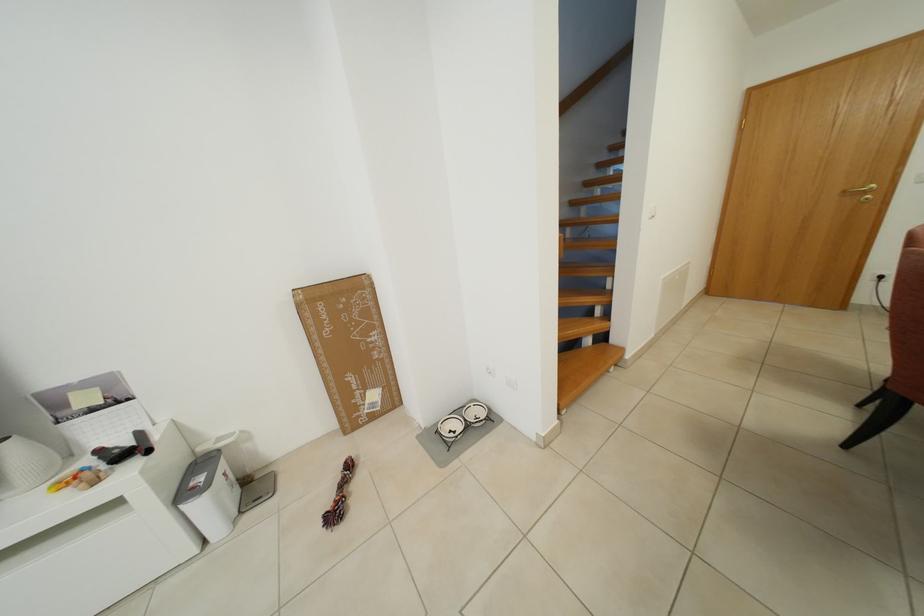
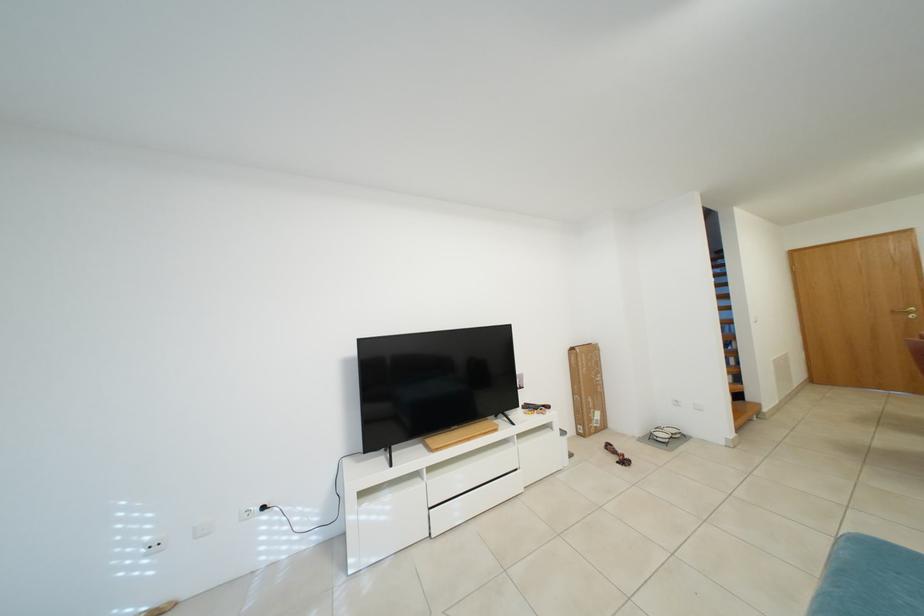
Locate, in the second image, the point that corresponds to pixel 382 400 in the first image.

(605, 419)